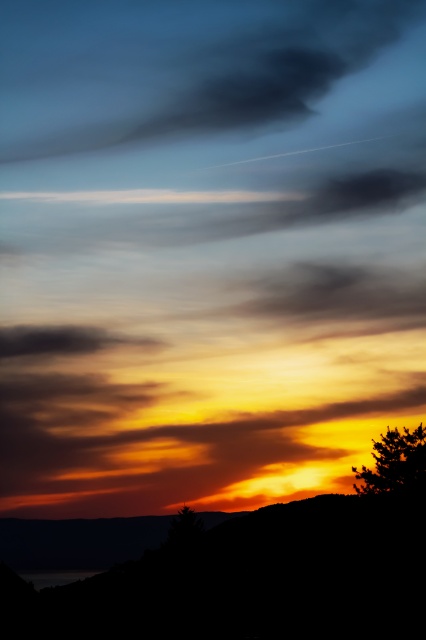
Question: Can you confirm if dark gray cloud at upper center is bigger than silhouette tree at lower right?

Choices:
 (A) yes
 (B) no

Answer: (A)

Question: Which object is positioned farthest from the dark gray cloud at upper center?

Choices:
 (A) smokey gray cloud at upper center
 (B) silhouette hillside at lower left
 (C) silhouette tree at lower right

Answer: (C)

Question: Is silhouette tree at lower right bigger than dark matte cloud at center?

Choices:
 (A) yes
 (B) no

Answer: (B)

Question: Which point is farther from the camera taking this photo?

Choices:
 (A) (46, 81)
 (B) (344, 518)

Answer: (A)

Question: Estimate the real-world distances between objects in this image. Which object is closer to the dark gray cloud at upper center?

Choices:
 (A) dark matte cloud at center
 (B) silhouette hillside at lower left
 (C) smokey gray cloud at upper center
 (D) silhouette tree at lower right

Answer: (C)

Question: Does silhouette hillside at lower left appear on the right side of smokey gray cloud at upper center?

Choices:
 (A) no
 (B) yes

Answer: (B)